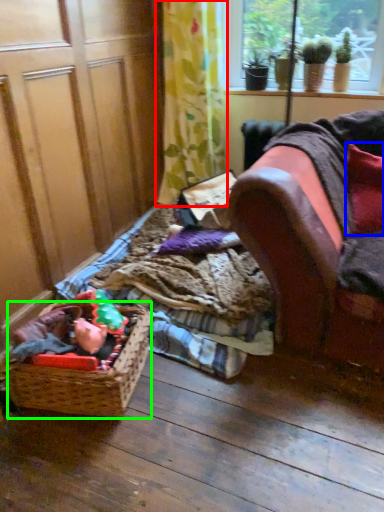
Question: Which object is positioned closest to curtain (highlighted by a red box)? Select from pillow (highlighted by a blue box) and basket (highlighted by a green box).

Choices:
 (A) pillow
 (B) basket

Answer: (A)